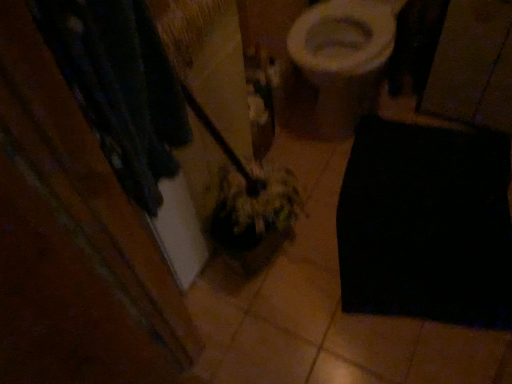
Measure the distance between white glossy toilet at upper center and camera.

The depth of white glossy toilet at upper center is 4.79 feet.

What is the approximate height of white glossy toilet at upper center?

27.26 inches.

Describe the element at coordinates (338, 63) in the screenshot. I see `white glossy toilet at upper center` at that location.

Where is `white glossy toilet at upper center`? The height and width of the screenshot is (384, 512). white glossy toilet at upper center is located at coordinates (338, 63).

Find the location of a particular element. white glossy toilet at upper center is located at coordinates (338, 63).